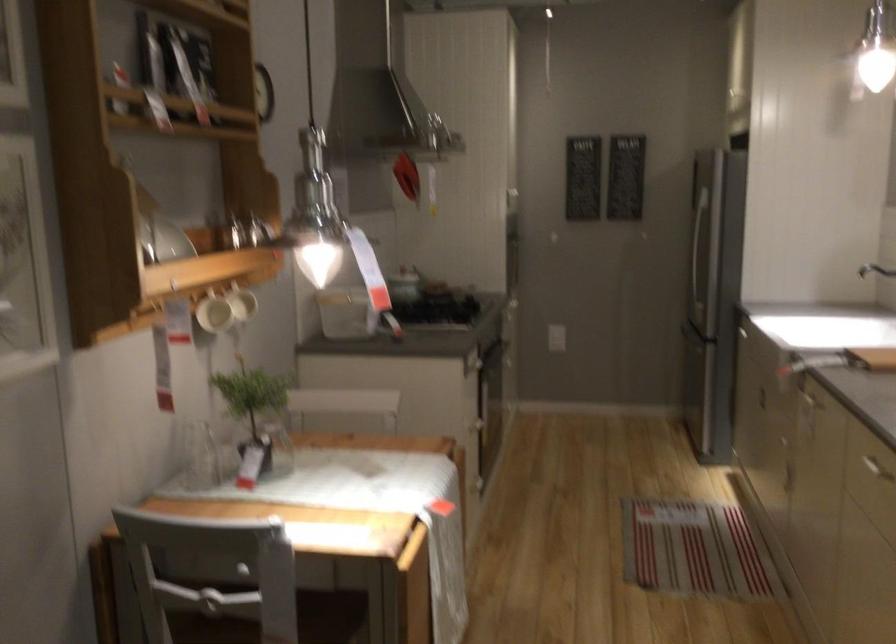
What do you see at coordinates (874, 270) in the screenshot? I see `a sink faucet handle` at bounding box center [874, 270].